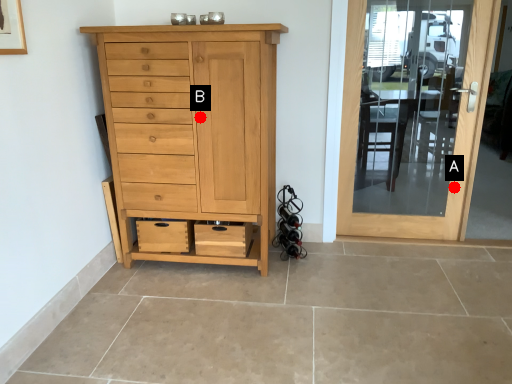
Question: Two points are circled on the image, labeled by A and B beside each circle. Which of the following is the farthest from the observer?

Choices:
 (A) A is further
 (B) B is further

Answer: (A)